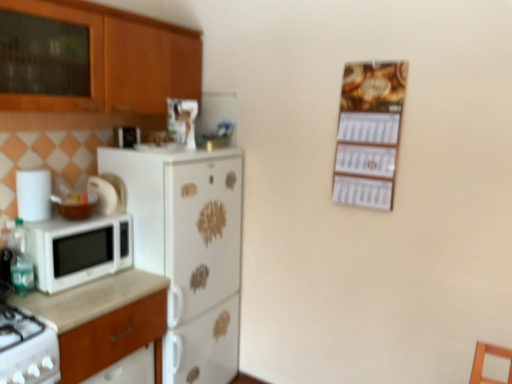
Question: Based on their positions, is white matte refrigerator at center-left located to the left or right of white matte container at left, the first appliance when ordered from bottom to top?

Choices:
 (A) left
 (B) right

Answer: (B)

Question: In terms of height, does white matte refrigerator at center-left look taller or shorter compared to white matte container at left, the 1th appliance positioned from the left?

Choices:
 (A) tall
 (B) short

Answer: (A)

Question: Based on their relative distances, which object is nearer to the translucent plastic bottle at left?

Choices:
 (A) white matte container at left, which is the 1th appliance from front to back
 (B) white matte refrigerator at center-left
 (C) white glossy gas stove at lower left
 (D) white glossy toaster at upper left, which ranks as the 2th appliance in bottom-to-top order
 (E) wooden calendar at upper right

Answer: (A)

Question: Which is farther from the wooden cabinet at upper left?

Choices:
 (A) translucent plastic bottle at left
 (B) wooden calendar at upper right
 (C) white matte microwave at left
 (D) white glossy gas stove at lower left
 (E) white glossy toaster at upper left, which appears as the 2th appliance when viewed from the front

Answer: (D)